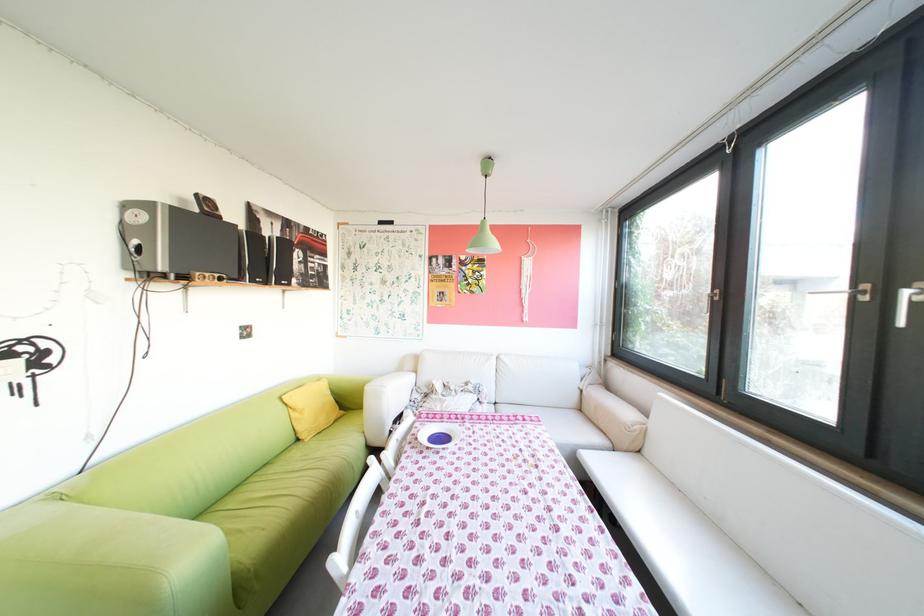
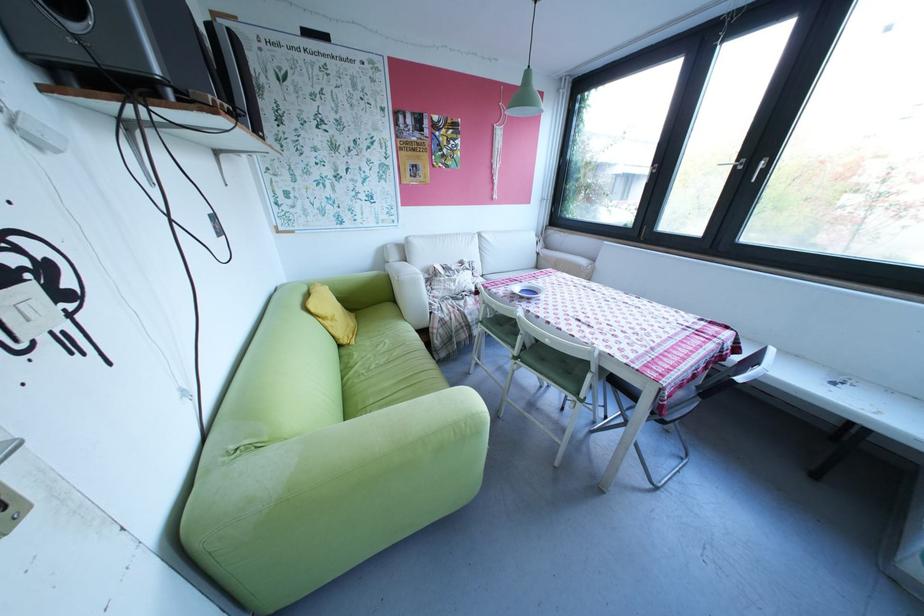
Locate, in the second image, the point that corresponds to [482,281] in the first image.

(457, 151)